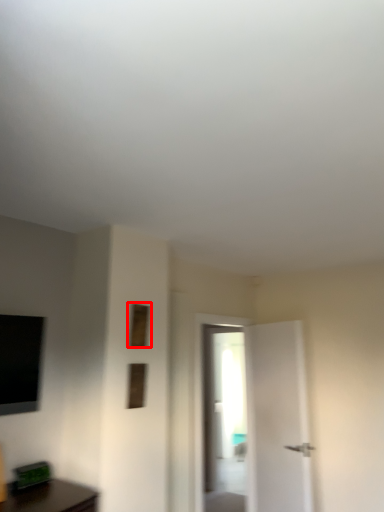
Question: From the image's perspective, what is the correct spatial positioning of window (annotated by the red box) in reference to window?

Choices:
 (A) above
 (B) below

Answer: (A)